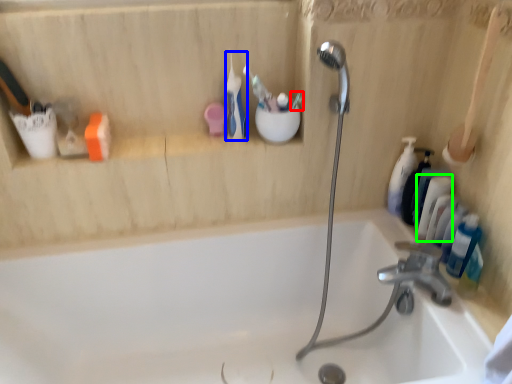
Question: Based on their relative distances, which object is farther from toothbrush (highlighted by a red box)? Choose from toothbrush (highlighted by a blue box) and toiletry (highlighted by a green box).

Choices:
 (A) toothbrush
 (B) toiletry

Answer: (B)